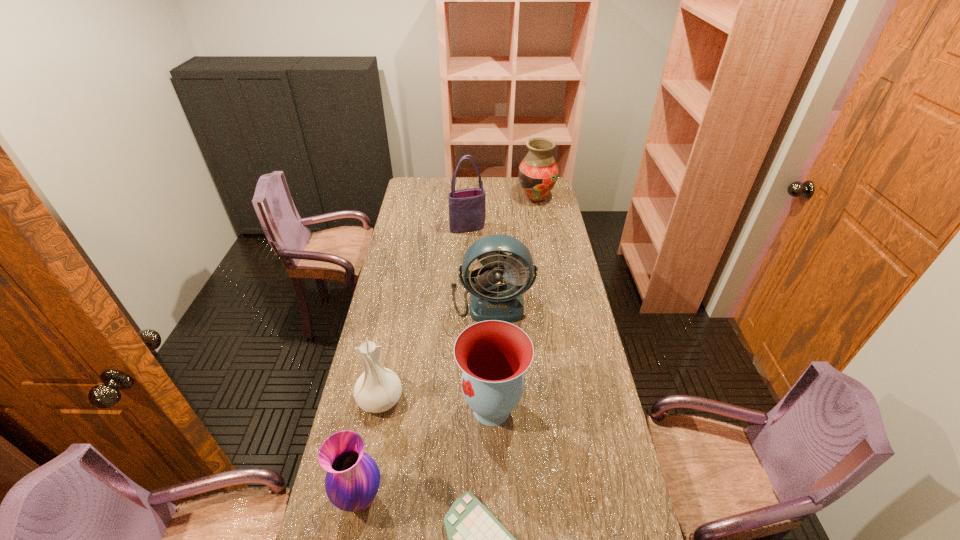
Locate an element on the screen. object that stands as the third closest to the computer keyboard is located at coordinates (378, 389).

The width and height of the screenshot is (960, 540). What are the coordinates of `object that is the fifth closest to the third farthest object` in the screenshot? It's located at (352, 481).

Identify the location of vase that is the closest to the farthest vase. Image resolution: width=960 pixels, height=540 pixels. (493, 355).

Identify the location of vase that stands as the closest to the computer keyboard. The width and height of the screenshot is (960, 540). (493, 355).